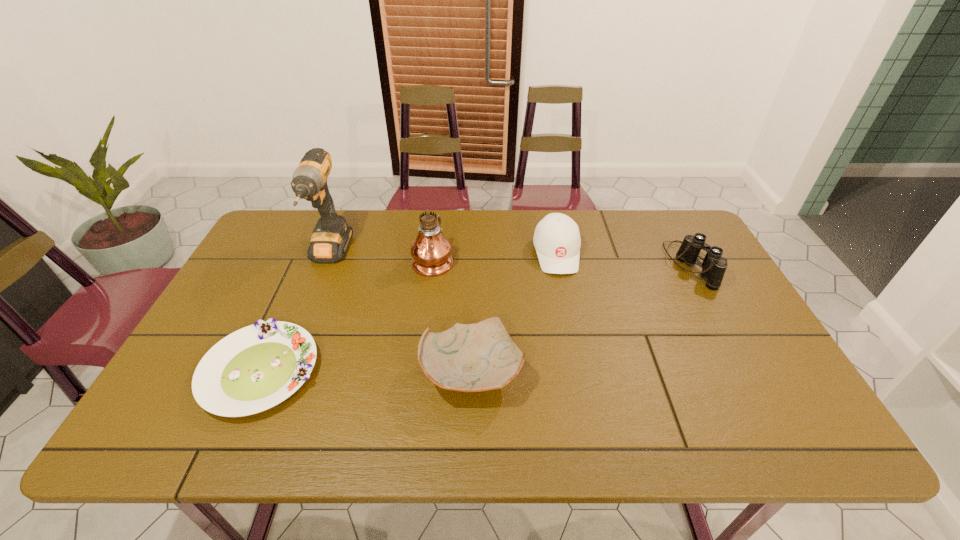
Where is `free location located 0.240m on the right of the pottery`? This screenshot has width=960, height=540. free location located 0.240m on the right of the pottery is located at coordinates (623, 372).

Locate an element on the screen. This screenshot has width=960, height=540. free space located 0.400m on the right of the salad plate is located at coordinates (485, 371).

Where is `oil lamp that is at the far edge`? oil lamp that is at the far edge is located at coordinates (431, 251).

Identify the location of drill present at the far edge. The image size is (960, 540). (330, 239).

Find the location of a particular element. This screenshot has width=960, height=540. baseball cap that is at the far edge is located at coordinates click(x=557, y=241).

Locate an element on the screen. The height and width of the screenshot is (540, 960). binoculars that is at the far edge is located at coordinates (714, 266).

This screenshot has height=540, width=960. What are the coordinates of `pottery that is positioned at the near edge` in the screenshot? It's located at (482, 356).

You are a GUI agent. You are given a task and a screenshot of the screen. Output one action in this format:
    pyautogui.click(x=<x>, y=<y>)
    Task: Click on the salad plate positioned at the near edge
    Image resolution: width=960 pixels, height=540 pixels.
    Given the screenshot: What is the action you would take?
    pyautogui.click(x=255, y=368)

This screenshot has height=540, width=960. I want to click on object that is at the left edge, so click(255, 368).

This screenshot has width=960, height=540. What are the coordinates of `object that is at the right edge` in the screenshot? It's located at (714, 266).